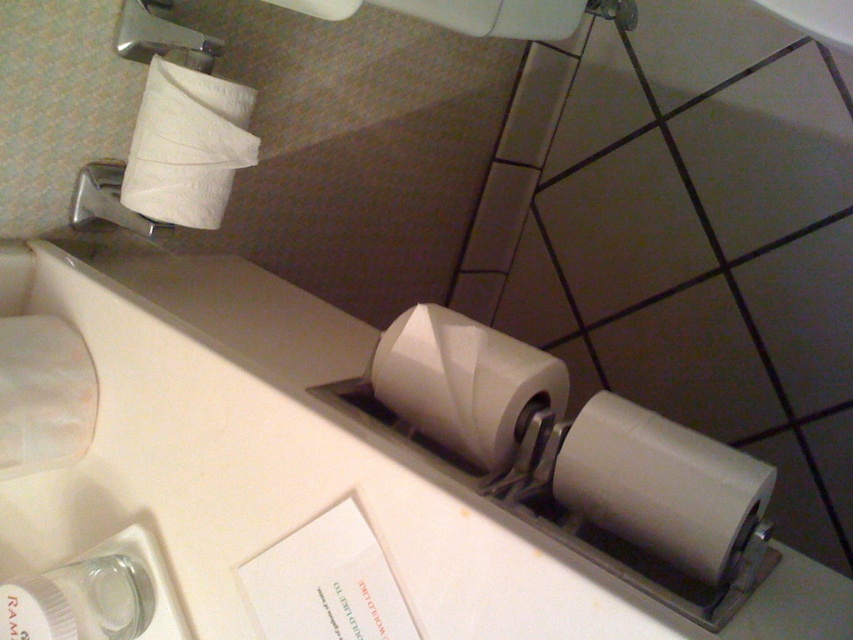
Does white matte toilet paper at lower center come behind white matte toilet paper at lower left?

No, white matte toilet paper at lower center is in front of white matte toilet paper at lower left.

Describe the element at coordinates (660, 484) in the screenshot. I see `white matte toilet paper at lower center` at that location.

The height and width of the screenshot is (640, 853). Describe the element at coordinates (660, 484) in the screenshot. I see `white matte toilet paper at lower center` at that location.

Where is `white matte toilet paper at lower center`? The width and height of the screenshot is (853, 640). white matte toilet paper at lower center is located at coordinates (660, 484).

Measure the distance from white matte counter top at center to white matte toilet paper at lower center.

7.30 inches

Is point (276, 323) positioned after point (675, 547)?

Yes, it is.

Which is behind, point (351, 454) or point (610, 410)?

Point (610, 410)

Find the location of `white matte counter top at center`. white matte counter top at center is located at coordinates (368, 483).

The image size is (853, 640). Describe the element at coordinates (187, 147) in the screenshot. I see `white matte toilet paper at upper left` at that location.

Does white matte toilet paper at upper left appear over white matte toilet paper at lower left?

Yes, white matte toilet paper at upper left is above white matte toilet paper at lower left.

Does point (165, 122) come in front of point (38, 387)?

No, it is behind (38, 387).

This screenshot has width=853, height=640. Identify the location of white matte toilet paper at upper left. (187, 147).